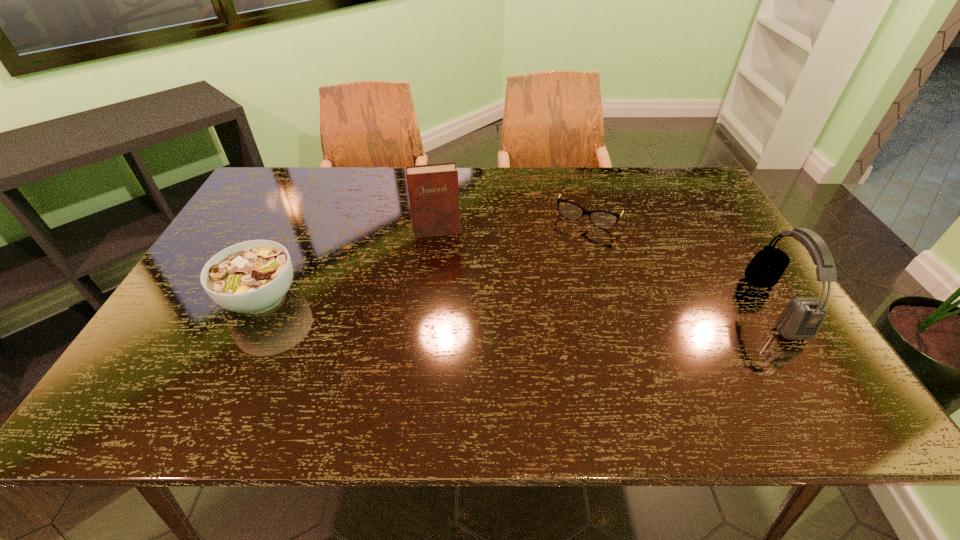
Identify the location of free spot between the rightmost object and the third object from right to left. 605,269.

The image size is (960, 540). Identify the location of free spot between the third tallest object and the second object from right to left. (427, 254).

Where is `vacant space that is in between the second object from right to left and the headset`? vacant space that is in between the second object from right to left and the headset is located at coordinates (683, 258).

Locate an element on the screen. free space that is in between the leftmost object and the diary is located at coordinates (349, 265).

Identify the location of free space between the soup bowl and the second object from left to right. The height and width of the screenshot is (540, 960). (349, 265).

Find the location of a particular element. This screenshot has height=540, width=960. the third closest object to the third object from left to right is located at coordinates (252, 277).

The width and height of the screenshot is (960, 540). In order to click on the second closest object to the shortest object in this screenshot , I will do `click(433, 192)`.

Find the location of a particular element. The image size is (960, 540). vacant point that satisfies the following two spatial constraints: 1. on the back side of the soup bowl; 2. on the left side of the third object from left to right is located at coordinates (304, 210).

At what (x,y) coordinates should I click in order to perform the action: click on free location that satisfies the following two spatial constraints: 1. on the back side of the second object from left to right; 2. on the right side of the second shortest object. Please return your answer as a coordinate pair (x, y). The image size is (960, 540). Looking at the image, I should click on (294, 231).

Where is `vacant region that satisfies the following two spatial constraints: 1. on the front side of the spectacles; 2. on the headband of the headset`? vacant region that satisfies the following two spatial constraints: 1. on the front side of the spectacles; 2. on the headband of the headset is located at coordinates (623, 306).